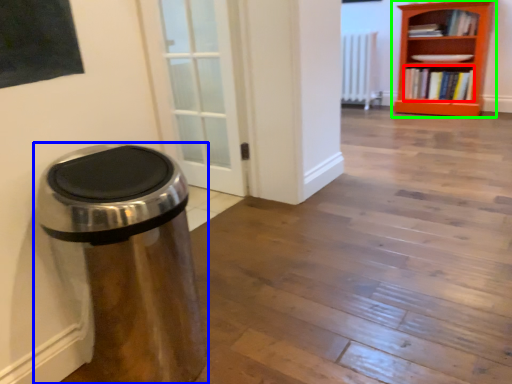
Question: Based on their relative distances, which object is farther from book (highlighted by a red box)? Choose from waste container (highlighted by a blue box) and bookcase (highlighted by a green box).

Choices:
 (A) waste container
 (B) bookcase

Answer: (A)